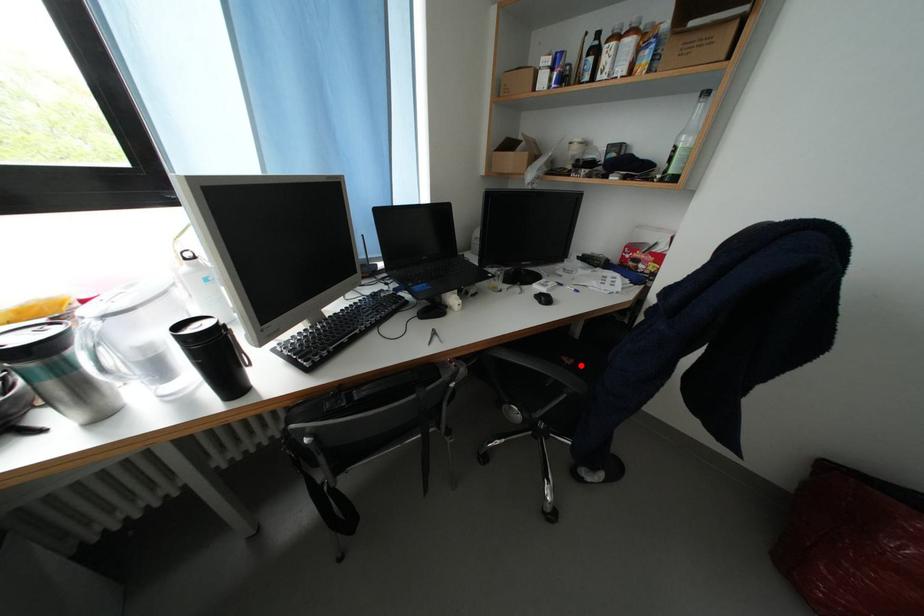
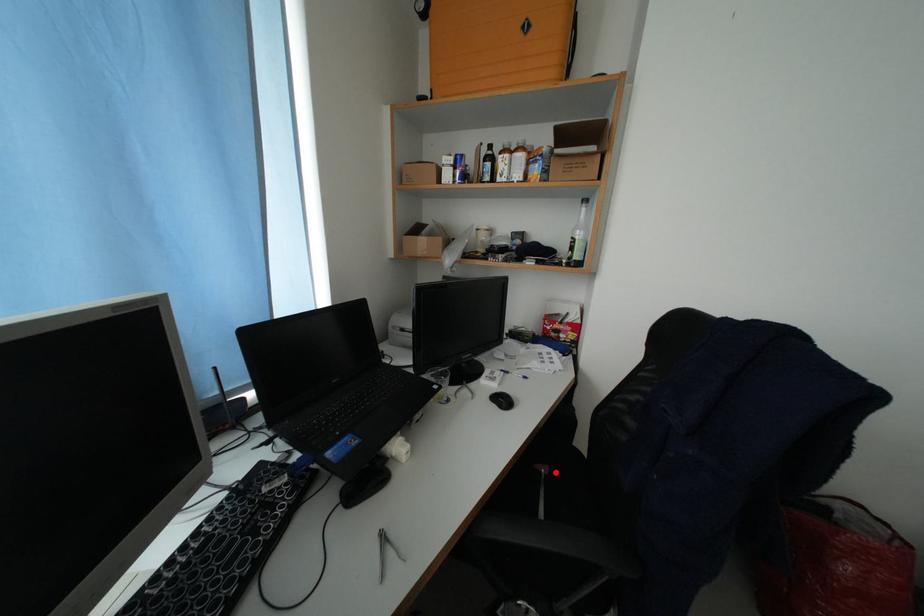
I am providing you with two images of the same scene from different viewpoints. A red point is marked on the first image and another point is marked on the second image. Is the red point in image1 aligned with the point shown in image2?

Yes